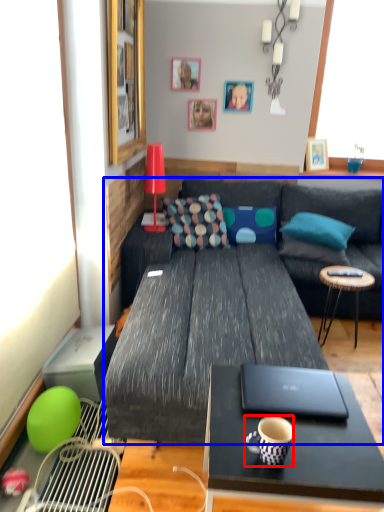
Question: Which object appears closest to the camera in this image, coffee cup (highlighted by a red box) or studio couch (highlighted by a blue box)?

Choices:
 (A) coffee cup
 (B) studio couch

Answer: (A)